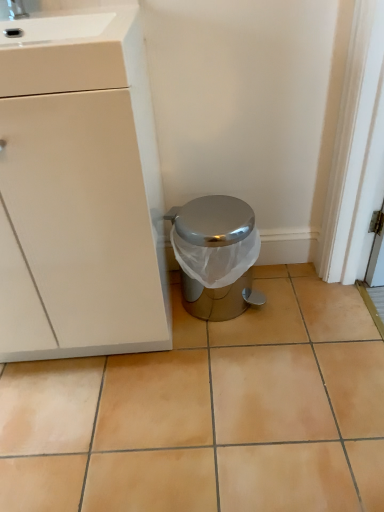
Question: Is point (13, 472) positioned closer to the camera than point (66, 126)?

Choices:
 (A) closer
 (B) farther

Answer: (B)

Question: Is beige ceramic tile at center inside or outside of white matte cabinet at left?

Choices:
 (A) inside
 (B) outside

Answer: (B)

Question: Which object is the closest to the beige ceramic tile at center?

Choices:
 (A) shiny metallic trash can at center
 (B) white matte cabinet at left

Answer: (A)

Question: Based on their relative distances, which object is nearer to the beige ceramic tile at center?

Choices:
 (A) white matte cabinet at left
 (B) shiny metallic trash can at center

Answer: (B)